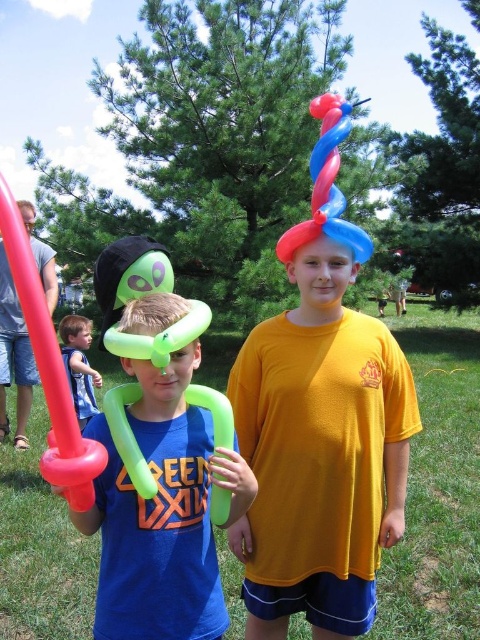
You are trying to decide which item to take for a game of tag. You need something that can be used as a shield. Based on their widths, which item between the green matte balloon sword at left and the green rubber balloon at center would be more suitable?

The green matte balloon sword at left might be wider than the green rubber balloon at center, so it would be more suitable as a shield.

You are a photographer trying to capture a picture of the two boys. You want to ensure both the rubber balloon sword at left and the green rubber balloon at center are visible in the frame. Which object should you position closer to the center of the image to achieve this?

The green rubber balloon at center is already at the center of the image, so positioning it closer to the center would maintain its visibility. The rubber balloon sword at left is on the left side, so moving it towards the center would help both objects be visible in the frame.